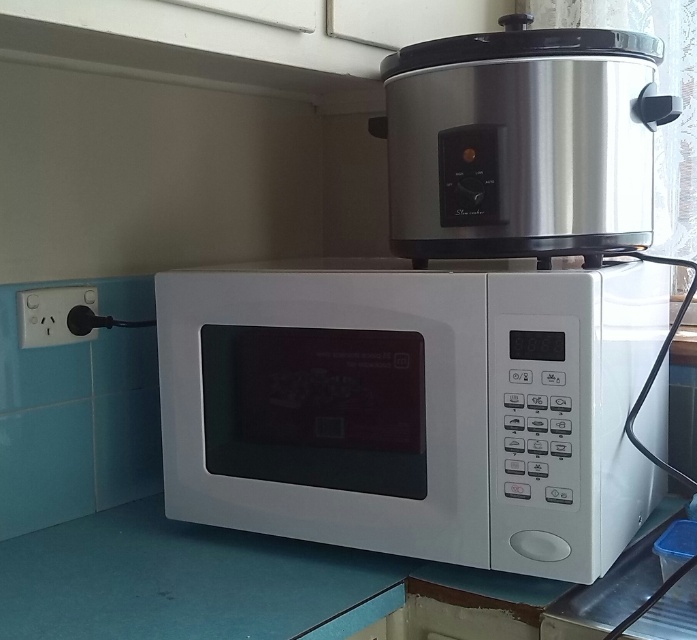
You are trying to place a new kitchen gadget on the satin silver cooker at upper center and the white glossy countertop at lower center. Which surface can accommodate a larger item?

The satin silver cooker at upper center is larger in size than the white glossy countertop at lower center, so it can accommodate a larger item.